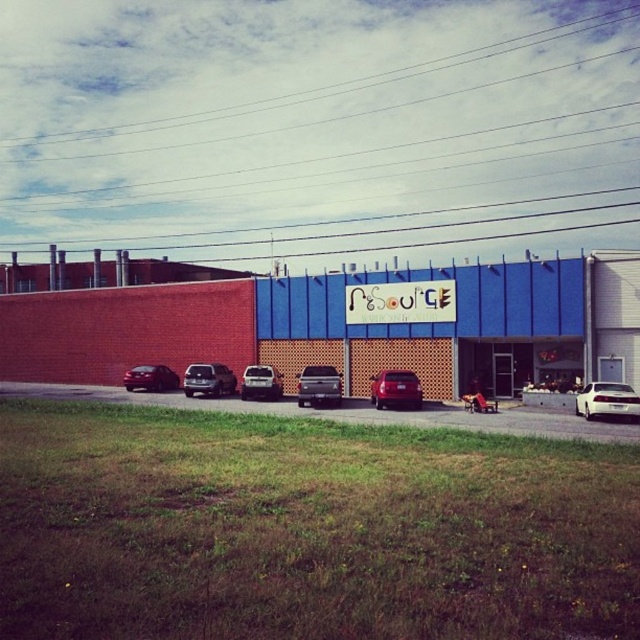
You are a delivery driver who needs to park your vehicle between the metallic silver truck at center and the satin silver suv at center. Based on the scene description, can you fit your truck, which is 2 meters wide, in the space between them?

The metallic silver truck at center is positioned on the right side of the satin silver suv at center. Since the distance between them isn

You are a delivery driver who needs to park your 2.5 meter wide truck in the parking lot. There is a space between the metallic silver car at center and the white glossy car at right. Can your truck fit in that space?

The metallic silver car at center is wider than the white glossy car at right. Since the truck is 2.5 meters wide, it depends on the combined width of both cars. If the space between them is at least 2.5 meters, the truck can fit. However, without exact measurements, it is uncertain.